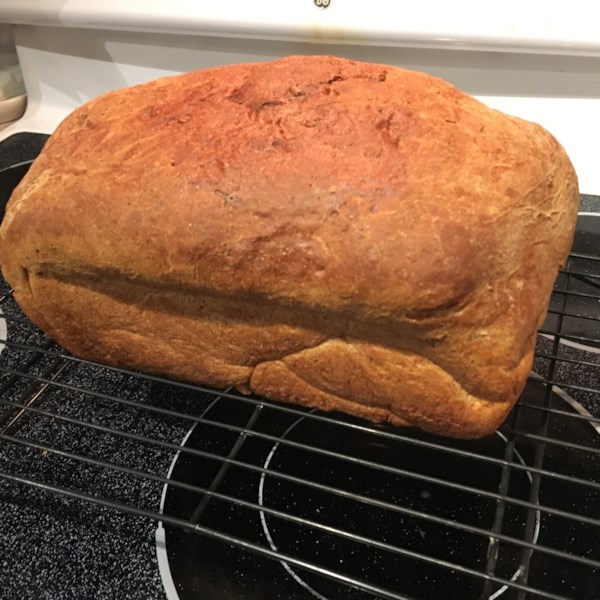
In order to click on back of stove in this screenshot , I will do `click(568, 112)`, `click(60, 75)`.